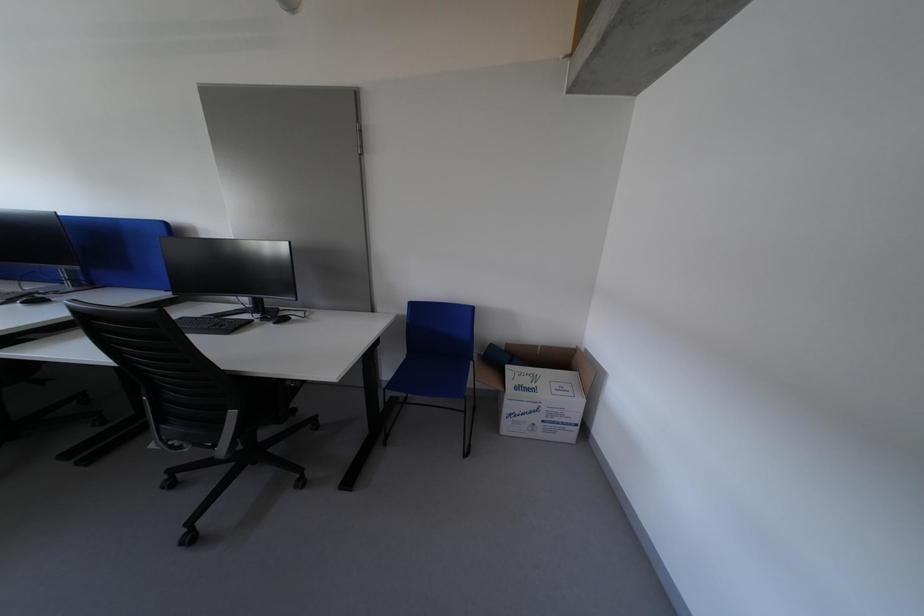
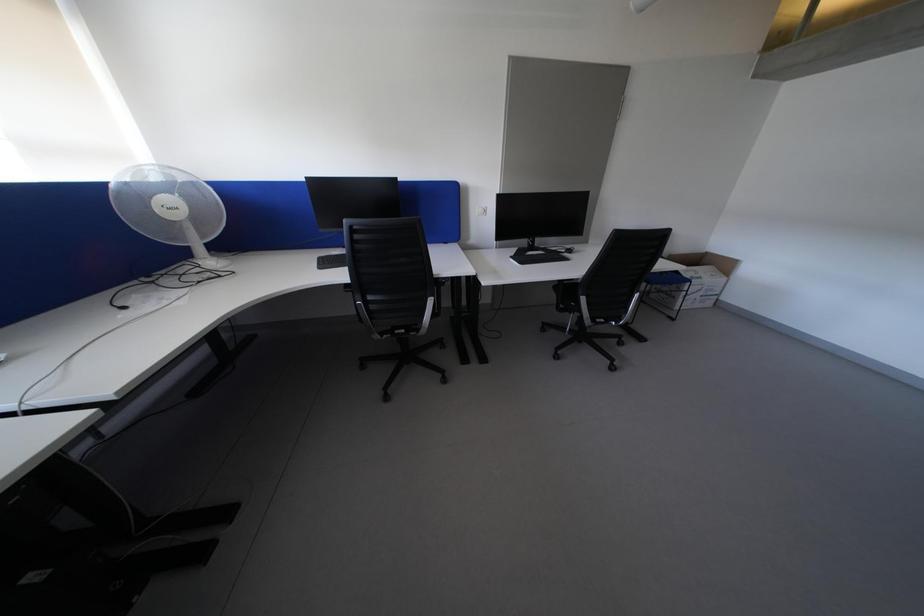
Question: Which direction would the cameraman need to move to produce the second image? Reply with the corresponding letter.

Choices:
 (A) Left
 (B) Right
 (C) Forward
 (D) Backward

Answer: (A)